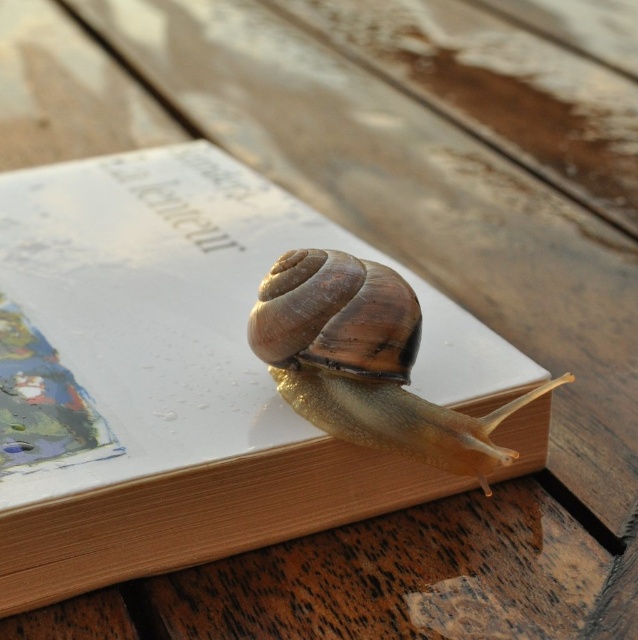
Question: Is white paper book at center below shiny brown shell at center?

Choices:
 (A) yes
 (B) no

Answer: (B)

Question: Among these points, which one is nearest to the camera?

Choices:
 (A) (211, 426)
 (B) (309, 289)

Answer: (A)

Question: Is white paper book at center above shiny brown shell at center?

Choices:
 (A) no
 (B) yes

Answer: (B)

Question: Considering the relative positions of white paper book at center and shiny brown shell at center in the image provided, where is white paper book at center located with respect to shiny brown shell at center?

Choices:
 (A) left
 (B) right

Answer: (A)